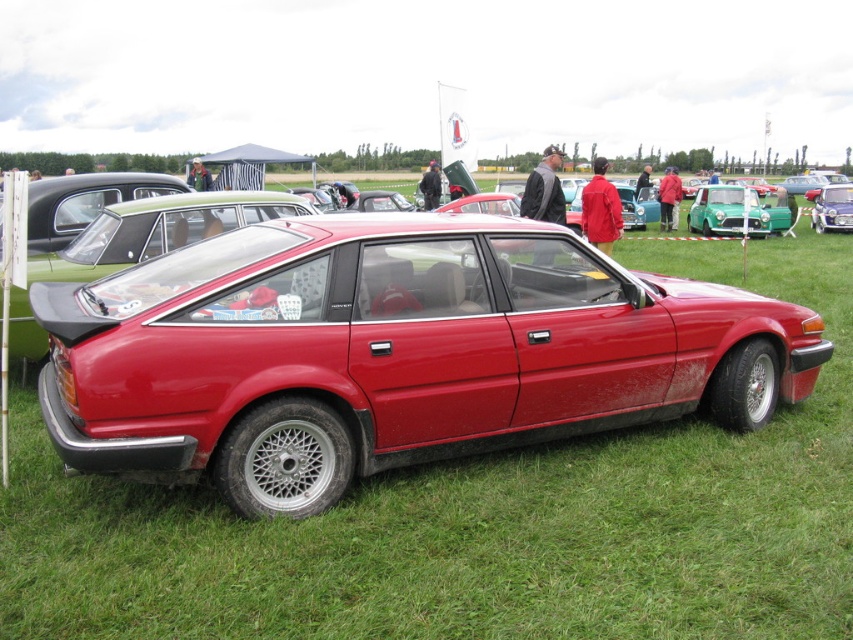
Question: Can you confirm if glossy red car at center is wider than white plastic license plate at center?

Choices:
 (A) yes
 (B) no

Answer: (A)

Question: Does green matte car at center appear under metallic silver car at center?

Choices:
 (A) yes
 (B) no

Answer: (A)

Question: Is metallic silver car at center bigger than white plastic license plate at center?

Choices:
 (A) yes
 (B) no

Answer: (A)

Question: Which of these objects is positioned closest to the metallic silver car at center?

Choices:
 (A) white plastic license plate at center
 (B) green matte car at center

Answer: (A)

Question: Which is nearer to the green matte car at center?

Choices:
 (A) metallic silver car at center
 (B) white plastic license plate at center
 (C) glossy red car at center

Answer: (A)

Question: Which point is farther to the camera?

Choices:
 (A) white plastic license plate at center
 (B) metallic silver car at center

Answer: (B)